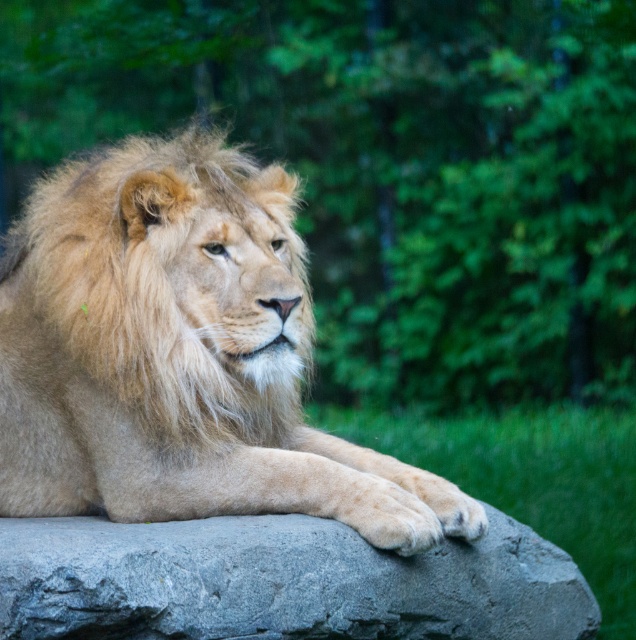
You are a photographer positioned at the origin point of the coordinate system. You want to capture both the lion resting on the rock and ensure that the point at coordinate point (499,67) and point (438,516) are visible in your shot. Based on their positions, which point will appear closer to the camera in your photo?

Point (438,516) will appear closer to the camera in the photo because it is in front of point (499,67) according to their spatial arrangement.

You are standing in front of the lion and want to place two markers at the specified coordinates. The first marker is at point [619,160] and the second at point [398,600]. Which marker will be closer to you?

Point [398,600] is closer to you because point [619,160] is behind it.

You are standing in front of the lion and looking at the scene. There is a point marked at coordinates (389, 168). What object is located at that point?

The point at coordinates (389, 168) indicates a green leafy tree at upper center.